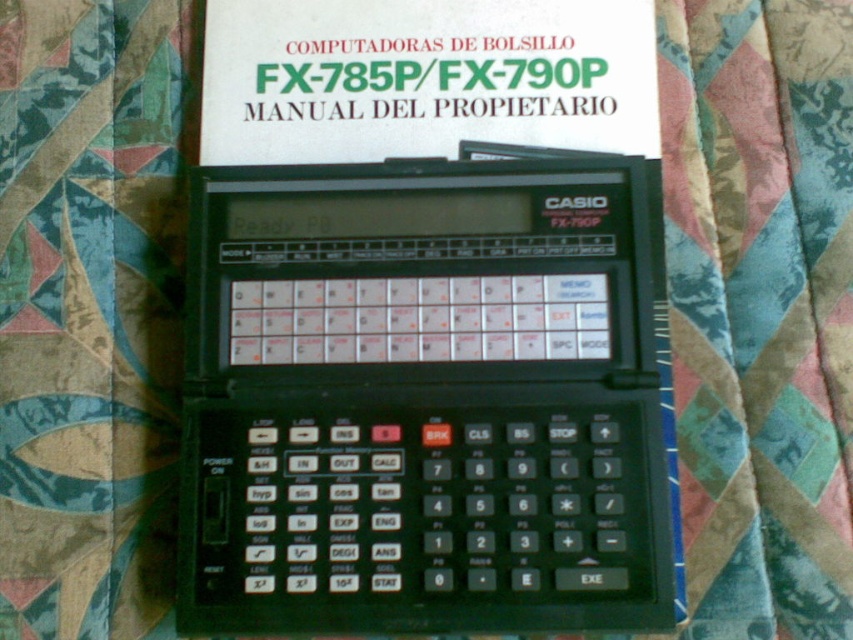
Measure the distance between black plastic calculator at center and white paper manual at upper center.

A distance of 7.90 inches exists between black plastic calculator at center and white paper manual at upper center.

The image size is (853, 640). What are the coordinates of `black plastic calculator at center` in the screenshot? It's located at (427, 397).

Image resolution: width=853 pixels, height=640 pixels. I want to click on black plastic calculator at center, so click(427, 397).

Is point (727, 77) more distant than point (549, 54)?

Yes.

Is textured fabric at center thinner than white paper manual at upper center?

Correct, textured fabric at center's width is less than white paper manual at upper center's.

Describe the element at coordinates (761, 308) in the screenshot. I see `textured fabric at center` at that location.

Identify the location of textured fabric at center. The width and height of the screenshot is (853, 640). pos(761,308).

Does black plastic calculator at center appear over textured fabric at center?

Incorrect, black plastic calculator at center is not positioned above textured fabric at center.

Is point (614, 330) positioned behind point (709, 518)?

Yes, point (614, 330) is farther from viewer.

The image size is (853, 640). In order to click on black plastic calculator at center in this screenshot , I will do `click(427, 397)`.